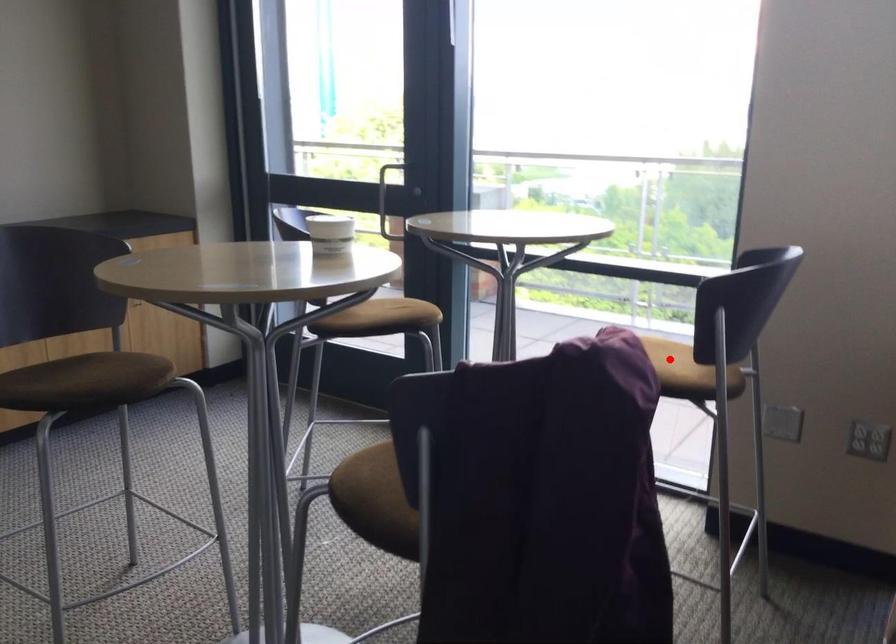
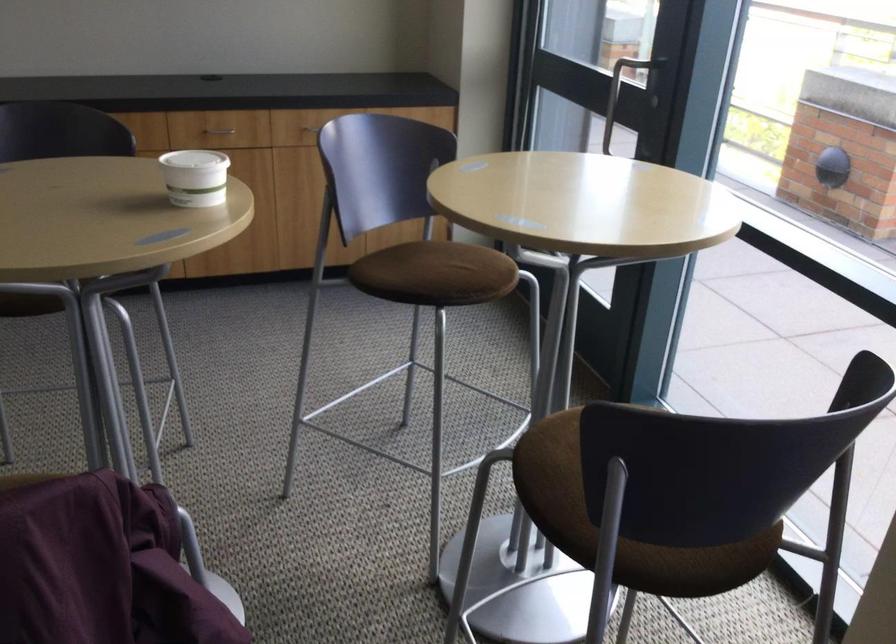
Question: I am providing you with two images of the same scene from different viewpoints. A red point is marked on the first image. At the location where the point appears in image 1, is it still visible in image 2?

Choices:
 (A) Yes
 (B) No

Answer: (B)